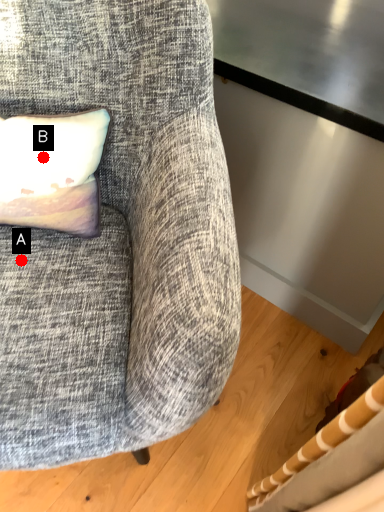
Question: Two points are circled on the image, labeled by A and B beside each circle. Which point is further to the camera?

Choices:
 (A) A is further
 (B) B is further

Answer: (B)